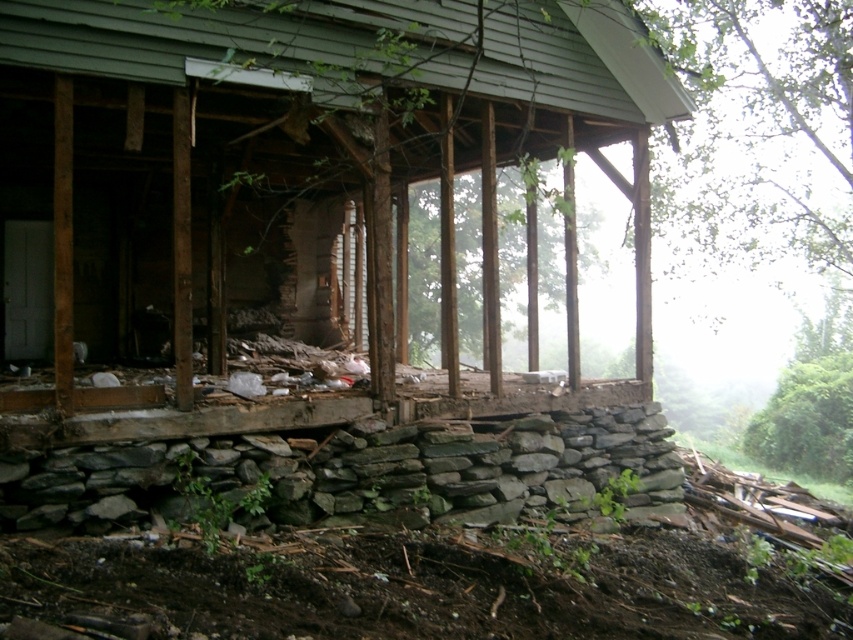
You are a construction worker assessing the porch structure. You see the weathered wood porch at center and the gray rough stone wall at lower center. Which object is located above the other?

The weathered wood porch at center is positioned over gray rough stone wall at lower center, so the weathered wood porch at center is above the gray rough stone wall at lower center.

You are standing on the ground level of the house and want to reach the weathered wood porch at center. Based on the 2D coordinates provided, in which direction should you move to reach it?

The weathered wood porch at center is located at coordinates point (283, 164), so you should move towards the lower left direction to reach it.

You are standing on the porch of the house and looking down at the ground below. Where is the gray rough stone wall at lower center located?

The gray rough stone wall at lower center is located at point (358,467).